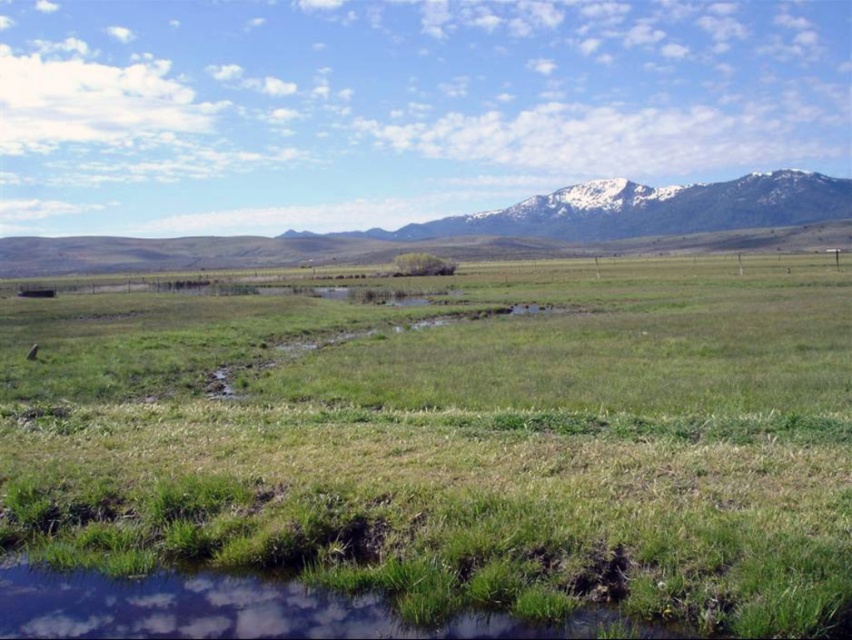
You are planning to take a photo of the green grassy field at center and the snowy rock mountain range at upper right. Which object will appear smaller in the photo?

The green grassy field at center will appear smaller in the photo because it is thinner than the snowy rock mountain range at upper right.